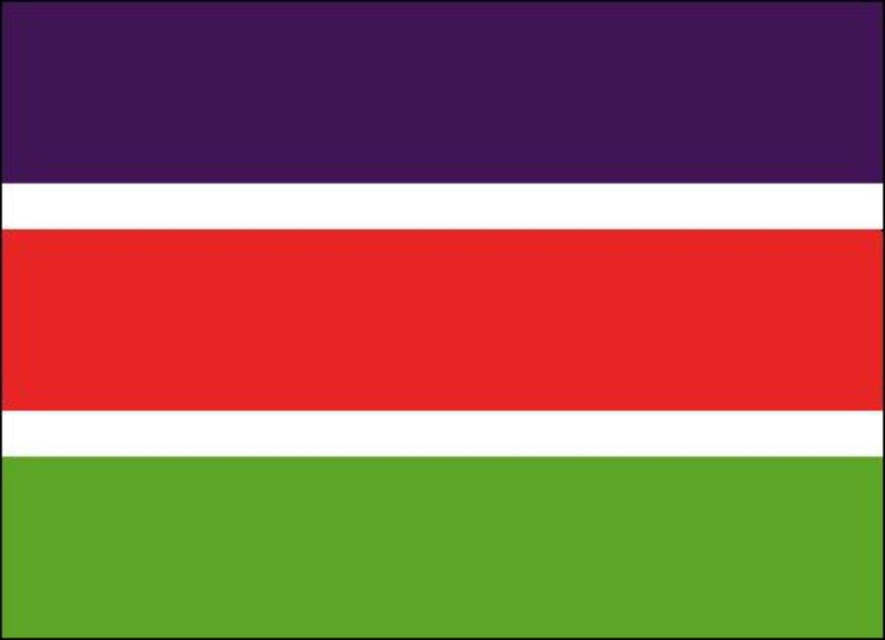
Is purple matte rectangle at upper left smaller than matte red rectangle at center?

Actually, purple matte rectangle at upper left might be larger than matte red rectangle at center.

Looking at this image, is purple matte rectangle at upper left to the left of matte red rectangle at center from the viewer's perspective?

Incorrect, purple matte rectangle at upper left is not on the left side of matte red rectangle at center.

Does point (33, 106) come farther from viewer compared to point (97, 348)?

No.

In order to click on purple matte rectangle at upper left in this screenshot , I will do `click(441, 92)`.

The image size is (885, 640). What do you see at coordinates (441, 320) in the screenshot? I see `matte red rectangle at center` at bounding box center [441, 320].

Where is `matte red rectangle at center`? matte red rectangle at center is located at coordinates (441, 320).

The image size is (885, 640). What do you see at coordinates (441, 92) in the screenshot?
I see `purple matte rectangle at upper left` at bounding box center [441, 92].

This screenshot has height=640, width=885. Find the location of `purple matte rectangle at upper left`. purple matte rectangle at upper left is located at coordinates (441, 92).

Describe the element at coordinates (441, 92) in the screenshot. The width and height of the screenshot is (885, 640). I see `purple matte rectangle at upper left` at that location.

Image resolution: width=885 pixels, height=640 pixels. What are the coordinates of `purple matte rectangle at upper left` in the screenshot? It's located at (441, 92).